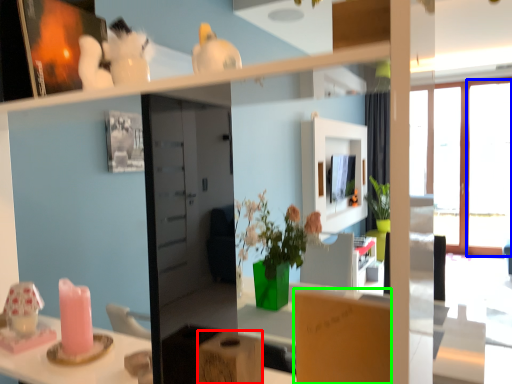
Question: Considering the real-world distances, which object is farthest from cardboard box (highlighted by a red box)? window (highlighted by a blue box) or cardboard box (highlighted by a green box)?

Choices:
 (A) window
 (B) cardboard box

Answer: (A)